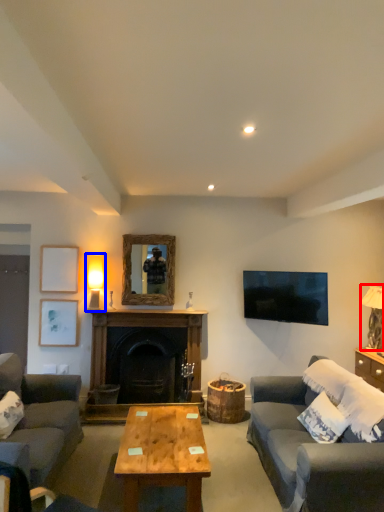
Question: Which object is closer to the camera taking this photo, table lamp (highlighted by a red box) or table lamp (highlighted by a blue box)?

Choices:
 (A) table lamp
 (B) table lamp

Answer: (A)